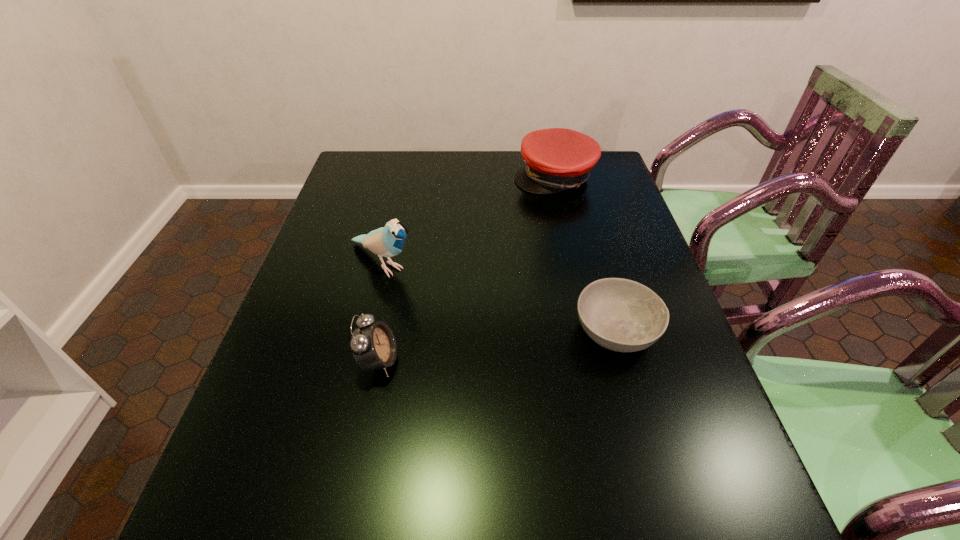
Locate an element on the screen. This screenshot has width=960, height=540. free location at the left edge of the desktop is located at coordinates (333, 318).

In the image, there is a desktop. Where is `vacant space at the right edge`? Image resolution: width=960 pixels, height=540 pixels. vacant space at the right edge is located at coordinates (635, 255).

Where is `vacant area at the far left corner`? This screenshot has width=960, height=540. vacant area at the far left corner is located at coordinates (378, 166).

The height and width of the screenshot is (540, 960). In the image, there is a desktop. Identify the location of vacant space at the near left corner. (228, 459).

Locate an element on the screen. vacant space at the far right corner is located at coordinates (612, 187).

At what (x,y) coordinates should I click in order to perform the action: click on vacant space at the near right corner. Please return your answer as a coordinate pair (x, y). The image size is (960, 540). Looking at the image, I should click on (651, 440).

The width and height of the screenshot is (960, 540). Find the location of `free space that is in between the alarm clock and the farthest object`. free space that is in between the alarm clock and the farthest object is located at coordinates (467, 269).

Find the location of `free space between the bowl and the alarm clock`. free space between the bowl and the alarm clock is located at coordinates (497, 346).

Where is `free space between the bowl and the alarm clock`? This screenshot has height=540, width=960. free space between the bowl and the alarm clock is located at coordinates (497, 346).

This screenshot has width=960, height=540. Identify the location of free spot between the alarm clock and the tallest object. (381, 312).